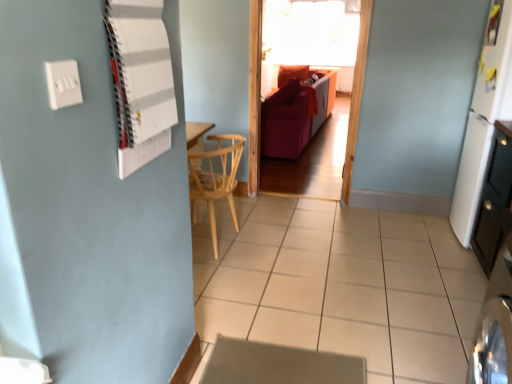
The image size is (512, 384). Find the location of `free space in front of transparent glass door at center`. free space in front of transparent glass door at center is located at coordinates (304, 214).